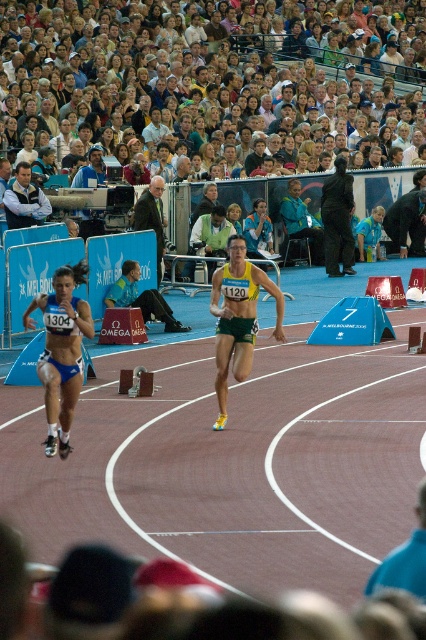
You are a photographer at the Melbourne 2006 Commonwealth Games. You need to capture a photo of the dark brown suit at center and the light blue fabric jacket at upper center. Based on their positions, which object is wider?

The dark brown suit at center might be wider than light blue fabric jacket at upper center.

You are a photographer at the Melbourne 2006 Commonwealth Games. You need to position your camera to capture the pink rubber track at center. According to the coordinates provided, where should you aim your camera?

The pink rubber track at center is located at coordinates point [236,456], so you should aim your camera at that specific 2D location to capture it.